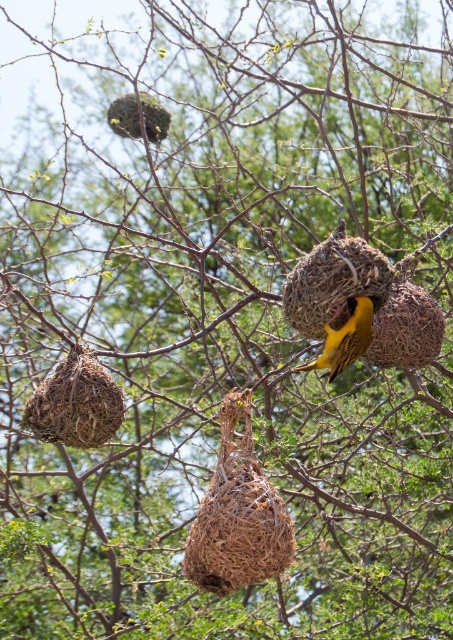
Question: Can you confirm if golden-yellow woven bird at center is smaller than brown woven nest at left?

Choices:
 (A) yes
 (B) no

Answer: (B)

Question: Does brown woven nest at center come behind brown woven nest at left?

Choices:
 (A) no
 (B) yes

Answer: (A)

Question: Based on their relative distances, which object is farther from the golden-yellow woven bird at center?

Choices:
 (A) brown woven nest at center
 (B) golden-yellow feathers at center
 (C) brown woven nest at left

Answer: (C)

Question: Does brown woven nest at left appear over golden-yellow feathers at center?

Choices:
 (A) no
 (B) yes

Answer: (A)

Question: Estimate the real-world distances between objects in this image. Which object is closer to the brown woven nest at left?

Choices:
 (A) golden-yellow woven bird at center
 (B) brown woven nest at center
 (C) golden-yellow feathers at center

Answer: (B)

Question: Which object is the farthest from the golden-yellow feathers at center?

Choices:
 (A) brown woven nest at center
 (B) brown woven nest at left

Answer: (B)